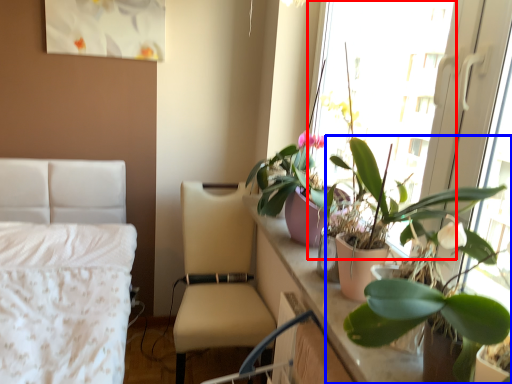
Question: Among these objects, which one is farthest to the camera, window screen (highlighted by a red box) or houseplant (highlighted by a blue box)?

Choices:
 (A) window screen
 (B) houseplant

Answer: (A)